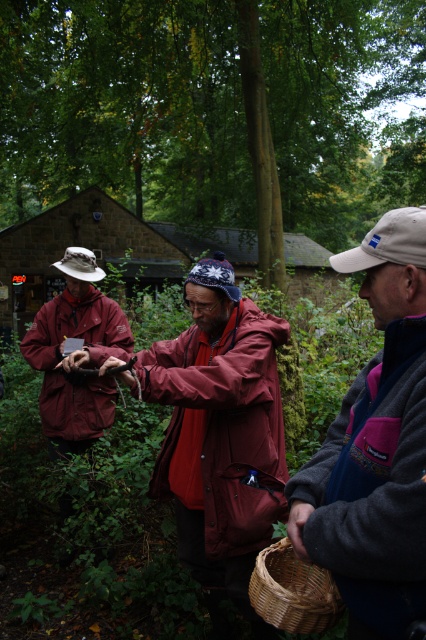
Is red matte jacket at center smaller than woven straw basket at lower center?

Actually, red matte jacket at center might be larger than woven straw basket at lower center.

Who is lower down, red matte jacket at center or woven straw basket at lower center?

woven straw basket at lower center

Between point (408, 276) and point (293, 556), which one is positioned in front?

Point (408, 276) is more forward.

Where is `red matte jacket at center`? Image resolution: width=426 pixels, height=640 pixels. red matte jacket at center is located at coordinates (374, 438).

The height and width of the screenshot is (640, 426). Find the location of `red matte jacket at center`. red matte jacket at center is located at coordinates (374, 438).

Which is in front, point (412, 248) or point (34, 332)?

Positioned in front is point (412, 248).

The width and height of the screenshot is (426, 640). What do you see at coordinates (374, 438) in the screenshot? I see `red matte jacket at center` at bounding box center [374, 438].

The image size is (426, 640). Identify the location of red matte jacket at center. (374, 438).

Which is more to the right, red matte jacket at center or gray fleece jacket at center?

From the viewer's perspective, gray fleece jacket at center appears more on the right side.

Can you confirm if red matte jacket at center is taller than gray fleece jacket at center?

Yes.

Which is behind, point (336, 257) or point (397, 541)?

Positioned behind is point (336, 257).

At what (x,y) coordinates should I click in order to perform the action: click on red matte jacket at center. Please return your answer as a coordinate pair (x, y). The image size is (426, 640). Looking at the image, I should click on 374,438.